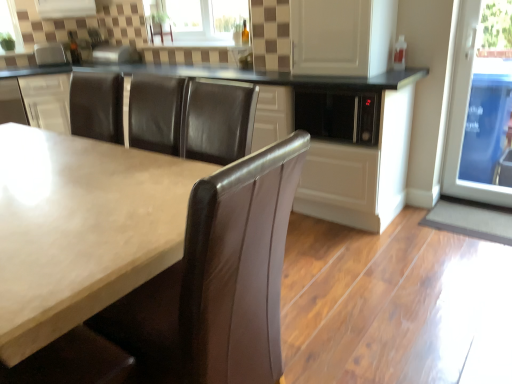
Image resolution: width=512 pixels, height=384 pixels. Describe the element at coordinates (81, 229) in the screenshot. I see `matte white countertop at center` at that location.

How much space does matte black microwave at center, which is the second cabinetry from left to right, occupy vertically?

The height of matte black microwave at center, which is the second cabinetry from left to right, is 86.20 centimeters.

Where is `white glossy cabinet at center, the 1th cabinetry from the left`? The height and width of the screenshot is (384, 512). white glossy cabinet at center, the 1th cabinetry from the left is located at coordinates (47, 101).

What do you see at coordinates (47, 101) in the screenshot? I see `white glossy cabinet at center, the 2th cabinetry when ordered from right to left` at bounding box center [47, 101].

This screenshot has height=384, width=512. Identify the location of transparent glass door at right. (481, 106).

This screenshot has height=384, width=512. What do you see at coordinates (199, 20) in the screenshot?
I see `clear glass window at upper center` at bounding box center [199, 20].

This screenshot has width=512, height=384. Identify the location of matte white countertop at center. (81, 229).

Between satin silver toaster at upper left and clear glass window at upper center, which one has larger width?

satin silver toaster at upper left is wider.

From their relative heights in the image, would you say satin silver toaster at upper left is taller or shorter than clear glass window at upper center?

satin silver toaster at upper left is shorter than clear glass window at upper center.

Looking at this image, is satin silver toaster at upper left to the left or to the right of clear glass window at upper center in the image?

Clearly, satin silver toaster at upper left is on the left of clear glass window at upper center in the image.

Does satin silver toaster at upper left contain white glossy cabinet at center, the 2th cabinetry when ordered from right to left?

No, white glossy cabinet at center, the 2th cabinetry when ordered from right to left, is not inside satin silver toaster at upper left.

How distant is satin silver toaster at upper left from white glossy cabinet at center, the 1th cabinetry from the left?

A distance of 17.38 inches exists between satin silver toaster at upper left and white glossy cabinet at center, the 1th cabinetry from the left.

Is satin silver toaster at upper left facing towards white glossy cabinet at center, the 2th cabinetry when ordered from right to left?

No, satin silver toaster at upper left is not aimed at white glossy cabinet at center, the 2th cabinetry when ordered from right to left.

Who is smaller, satin silver toaster at upper left or white glossy cabinet at center, the 1th cabinetry from the left?

Smaller between the two is satin silver toaster at upper left.

Does point (39, 323) appear closer or farther from the camera than point (222, 23)?

Point (39, 323) is positioned closer to the camera compared to point (222, 23).

Could clear glass window at upper center be considered to be inside matte white countertop at center?

No, clear glass window at upper center is not inside matte white countertop at center.

Find the location of a particular element. countertop below the clear glass window at upper center (from the image's perspective) is located at coordinates (81, 229).

From the image's perspective, which is above, matte white countertop at center or clear glass window at upper center?

From the image's view, clear glass window at upper center is above.

Considering the sizes of objects white glossy cabinet at center, the 2th cabinetry when ordered from right to left, and matte white countertop at center in the image provided, who is bigger, white glossy cabinet at center, the 2th cabinetry when ordered from right to left, or matte white countertop at center?

Bigger between the two is matte white countertop at center.

Is white glossy cabinet at center, the 1th cabinetry from the left, to the left or to the right of matte white countertop at center in the image?

Clearly, white glossy cabinet at center, the 1th cabinetry from the left, is on the left of matte white countertop at center in the image.

Between point (63, 123) and point (78, 226), which one is positioned in front?

Point (78, 226)

Measure the distance from white glossy cabinet at center, the 2th cabinetry when ordered from right to left, to matte white countertop at center.

white glossy cabinet at center, the 2th cabinetry when ordered from right to left, and matte white countertop at center are 6.68 feet apart.

Is there a large distance between matte black microwave at center, which is the second cabinetry from left to right, and transparent glass door at right?

They are positioned close to each other.

Between matte black microwave at center, which is the second cabinetry from left to right, and transparent glass door at right, which one is positioned behind?

matte black microwave at center, which is the second cabinetry from left to right, is further from the camera.

Considering the relative positions of matte black microwave at center, which is the second cabinetry from left to right, and transparent glass door at right in the image provided, is matte black microwave at center, which is the second cabinetry from left to right, to the left of transparent glass door at right from the viewer's perspective?

Correct, you'll find matte black microwave at center, which is the second cabinetry from left to right, to the left of transparent glass door at right.

Identify the location of window screen that is above the matte black microwave at center, which is the second cabinetry from left to right (from a real-world perspective). This screenshot has height=384, width=512. (481, 106).

Considering the sizes of objects matte white countertop at center and transparent glass door at right in the image provided, who is wider, matte white countertop at center or transparent glass door at right?

matte white countertop at center is wider.

Is matte white countertop at center oriented towards transparent glass door at right?

No, matte white countertop at center is not turned towards transparent glass door at right.

Where is `window screen located behind the matte white countertop at center`? Image resolution: width=512 pixels, height=384 pixels. window screen located behind the matte white countertop at center is located at coordinates click(x=481, y=106).

From the image's perspective, between matte white countertop at center and transparent glass door at right, who is located below?

matte white countertop at center appears lower in the image.

Between point (57, 62) and point (310, 74), which one is positioned in front?

The point (310, 74) is closer.

Can you tell me how much satin silver toaster at upper left and white glossy cabinet at upper center differ in facing direction?

The facing directions of satin silver toaster at upper left and white glossy cabinet at upper center are 51.5 degrees apart.

Find the location of `appliance behind the white glossy cabinet at upper center`. appliance behind the white glossy cabinet at upper center is located at coordinates (49, 54).

From the image's perspective, which object appears higher, satin silver toaster at upper left or white glossy cabinet at upper center?

satin silver toaster at upper left is shown above in the image.

Locate an element on the screen. The image size is (512, 384). window in front of the satin silver toaster at upper left is located at coordinates (199, 20).

This screenshot has height=384, width=512. Identify the location of appliance on the left of white glossy cabinet at center, the 1th cabinetry from the left. (49, 54).

When comparing their distances from clear glass window at upper center, does matte white countertop at center or satin silver toaster at upper left seem further?

matte white countertop at center is further to clear glass window at upper center.

When comparing their distances from matte black microwave at center, which is the second cabinetry from left to right, does transparent glass door at right or white glossy cabinet at center, the 1th cabinetry from the left, seem closer?

The object closer to matte black microwave at center, which is the second cabinetry from left to right, is transparent glass door at right.

Looking at the image, which one is located closer to transparent glass door at right, white glossy cabinet at upper center or clear glass window at upper center?

Based on the image, white glossy cabinet at upper center appears to be nearer to transparent glass door at right.

Which object lies nearer to the anchor point transparent glass door at right, matte black microwave at center, which is the second cabinetry from left to right, or clear glass window at upper center?

The object closer to transparent glass door at right is matte black microwave at center, which is the second cabinetry from left to right.

Based on the photo, estimate the real-world distances between objects in this image. Which object is further from matte black microwave at center, the first cabinetry viewed from the right, matte white countertop at center or white glossy cabinet at upper center?

matte white countertop at center is positioned further to the anchor matte black microwave at center, the first cabinetry viewed from the right.

From the image, which object appears to be farther from clear glass window at upper center, matte white countertop at center or matte black microwave at center, which is the second cabinetry from left to right?

Among the two, matte white countertop at center is located further to clear glass window at upper center.

Which object lies nearer to the anchor point matte white countertop at center, clear glass window at upper center or matte black microwave at center, the first cabinetry viewed from the right?

The object closer to matte white countertop at center is matte black microwave at center, the first cabinetry viewed from the right.

From the image, which object appears to be nearer to transparent glass door at right, satin silver toaster at upper left or matte black microwave at center, which is the second cabinetry from left to right?

matte black microwave at center, which is the second cabinetry from left to right.

Locate an element on the screen. window between matte white countertop at center and satin silver toaster at upper left from front to back is located at coordinates (199, 20).

Locate an element on the screen. This screenshot has width=512, height=384. screen door located between matte white countertop at center and clear glass window at upper center in the depth direction is located at coordinates (342, 36).

Where is `screen door positioned between matte white countertop at center and matte black microwave at center, the first cabinetry viewed from the right, from near to far`? The height and width of the screenshot is (384, 512). screen door positioned between matte white countertop at center and matte black microwave at center, the first cabinetry viewed from the right, from near to far is located at coordinates (342, 36).

The image size is (512, 384). I want to click on cabinetry between matte white countertop at center and white glossy cabinet at center, the 2th cabinetry when ordered from right to left, from front to back, so click(x=320, y=141).